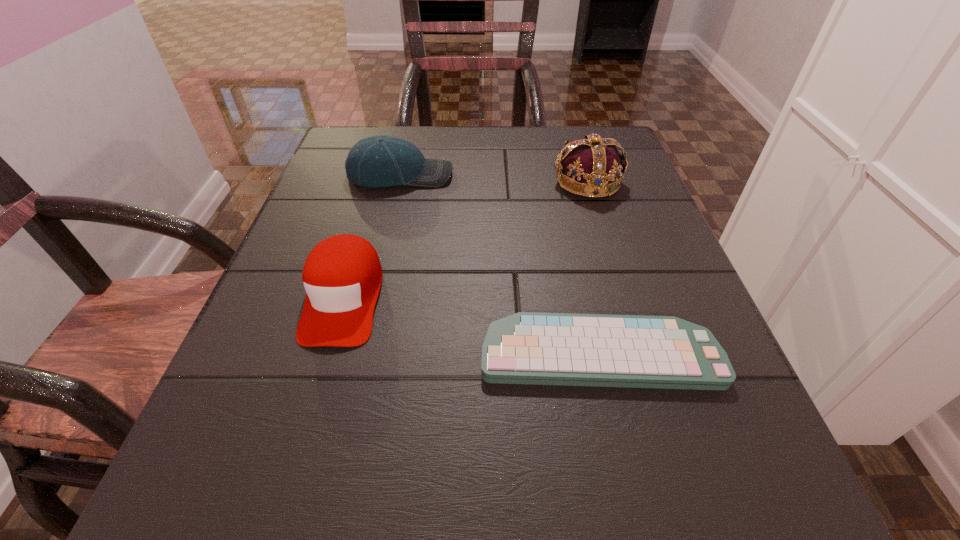
What are the coordinates of `free space that is in between the farther baseball cap and the computer keyboard` in the screenshot? It's located at (499, 264).

What are the coordinates of `blank region between the shortest object and the farther baseball cap` in the screenshot? It's located at (499, 264).

Locate an element on the screen. The width and height of the screenshot is (960, 540). free space between the crown and the computer keyboard is located at coordinates (593, 267).

Find the location of `vacant space in between the nearer baseball cap and the shortest object`. vacant space in between the nearer baseball cap and the shortest object is located at coordinates (471, 326).

At what (x,y) coordinates should I click in order to perform the action: click on free area in between the nearer baseball cap and the tallest object. Please return your answer as a coordinate pair (x, y). This screenshot has height=540, width=960. Looking at the image, I should click on (466, 240).

You are a GUI agent. You are given a task and a screenshot of the screen. Output one action in this format:
    pyautogui.click(x=<x>, y=<y>)
    Task: Click on the vacant area between the nearer baseball cap and the tallest object
    This screenshot has height=540, width=960.
    Given the screenshot: What is the action you would take?
    pyautogui.click(x=466, y=240)

Locate an element on the screen. vacant space in between the shortest object and the farther baseball cap is located at coordinates (499, 264).

Where is `free point between the farther baseball cap and the crown`? This screenshot has height=540, width=960. free point between the farther baseball cap and the crown is located at coordinates (493, 178).

Locate which object is the third closest to the farther baseball cap. Please provide its 2D coordinates. Your answer should be formatted as a tuple, i.e. [(x, y)], where the tuple contains the x and y coordinates of a point satisfying the conditions above.

[(636, 351)]

The height and width of the screenshot is (540, 960). Identify the location of the closest object relative to the computer keyboard. (342, 275).